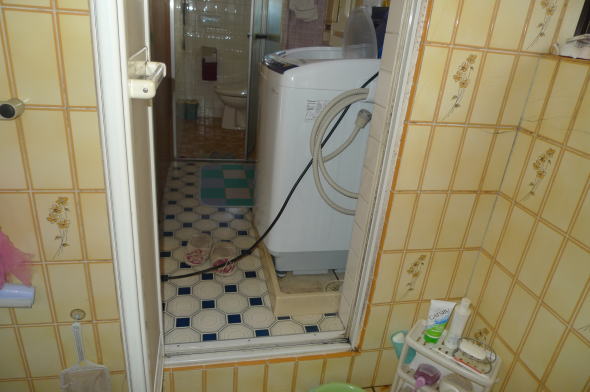
Where is `soap`? soap is located at coordinates point(467,347).